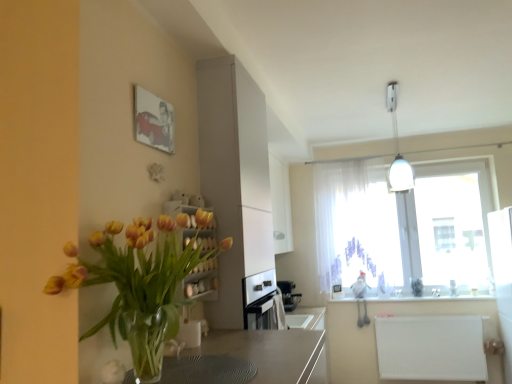
Question: Is sleek metallic coffee machine at center at the back of matte white cabinet at center?

Choices:
 (A) no
 (B) yes

Answer: (A)

Question: Would you say sleek metallic coffee machine at center is part of matte white cabinet at center's contents?

Choices:
 (A) yes
 (B) no

Answer: (B)

Question: From a real-world perspective, is matte white cabinet at center located higher than sleek metallic coffee machine at center?

Choices:
 (A) no
 (B) yes

Answer: (B)

Question: Considering the relative sizes of matte white cabinet at center and sleek metallic coffee machine at center in the image provided, is matte white cabinet at center smaller than sleek metallic coffee machine at center?

Choices:
 (A) no
 (B) yes

Answer: (A)

Question: Does matte white cabinet at center lie behind sleek metallic coffee machine at center?

Choices:
 (A) yes
 (B) no

Answer: (B)

Question: Do you think white glossy light fixture at upper right is within sleek metallic coffee machine at center, or outside of it?

Choices:
 (A) outside
 (B) inside

Answer: (A)

Question: From the image's perspective, is white glossy light fixture at upper right positioned above or below sleek metallic coffee machine at center?

Choices:
 (A) below
 (B) above

Answer: (B)

Question: Considering the positions of white glossy light fixture at upper right and sleek metallic coffee machine at center in the image, is white glossy light fixture at upper right wider or thinner than sleek metallic coffee machine at center?

Choices:
 (A) thin
 (B) wide

Answer: (B)

Question: Considering the positions of white glossy light fixture at upper right and sleek metallic coffee machine at center in the image, is white glossy light fixture at upper right taller or shorter than sleek metallic coffee machine at center?

Choices:
 (A) short
 (B) tall

Answer: (B)

Question: Is translucent fabric at upper right wider or thinner than white glossy light fixture at upper right?

Choices:
 (A) thin
 (B) wide

Answer: (A)

Question: Looking at the image, does translucent fabric at upper right seem bigger or smaller compared to white glossy light fixture at upper right?

Choices:
 (A) big
 (B) small

Answer: (A)

Question: Would you say translucent fabric at upper right is to the left or to the right of white glossy light fixture at upper right in the picture?

Choices:
 (A) right
 (B) left

Answer: (A)

Question: Considering the positions of point (434, 269) and point (396, 170), is point (434, 269) closer or farther from the camera than point (396, 170)?

Choices:
 (A) farther
 (B) closer

Answer: (A)

Question: From a real-world perspective, relative to white matte radiator at lower right, the 2th counter top positioned from the top, is white glossy light fixture at upper right vertically above or below?

Choices:
 (A) above
 (B) below

Answer: (A)

Question: Choose the correct answer: Is white glossy light fixture at upper right inside white matte radiator at lower right, the 1th counter top in the bottom-to-top sequence, or outside it?

Choices:
 (A) outside
 (B) inside

Answer: (A)